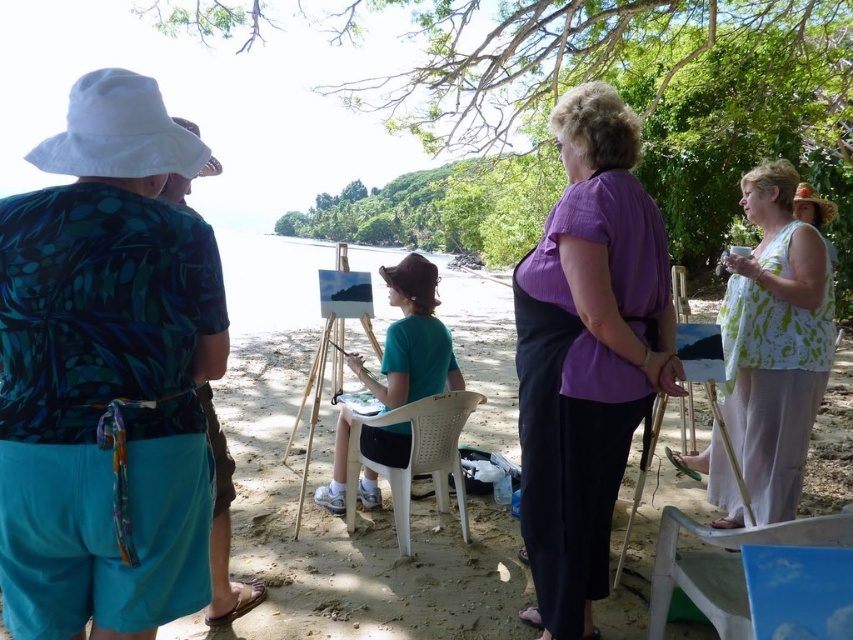
Is point (254, 556) farther from camera compared to point (721, 307)?

No.

Can you confirm if smooth sand beach at center is thinner than white printed blouse at center?

No.

Which is behind, point (463, 621) or point (769, 228)?

The point (769, 228) is behind.

What are the coordinates of `smooth sand beach at center` in the screenshot? It's located at (343, 528).

Is point (468, 90) positioned behind point (167, 179)?

Yes, it is.

Identify the location of green leafy tree at upper center. This screenshot has width=853, height=640. (628, 97).

Does white plastic chair at center have a lesser width compared to matte green shirt at left?

In fact, white plastic chair at center might be wider than matte green shirt at left.

Who is more forward, (x=440, y=429) or (x=231, y=612)?

Positioned in front is point (x=231, y=612).

In order to click on white plastic chair at center in this screenshot , I will do `click(416, 456)`.